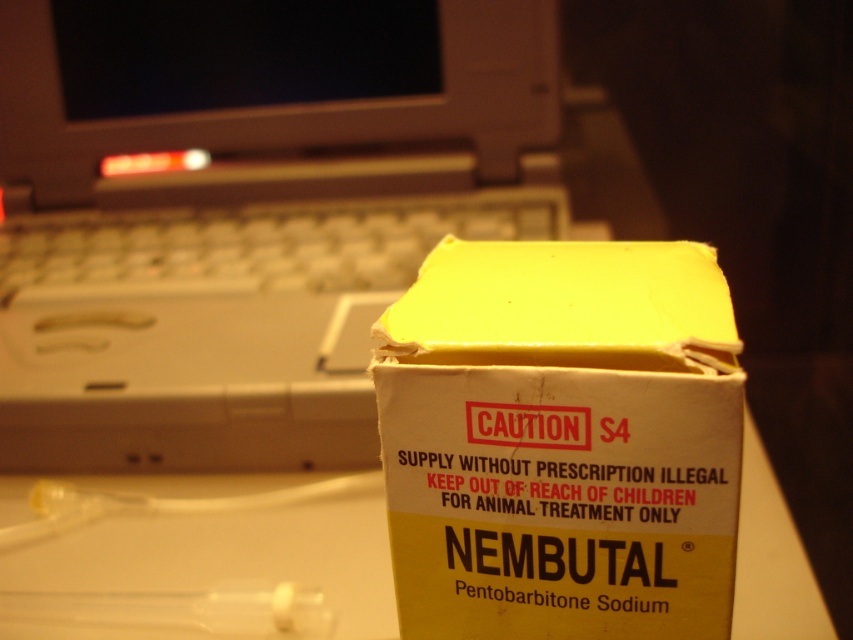
You need to place a 12 inch ruler between the yellow cardboard box at center and the white plastic keyboard at upper left. Is there enough space to fit it horizontally?

The distance between the yellow cardboard box at center and the white plastic keyboard at upper left is 24.52 inches. Since the ruler is 12 inches long, which is half of the distance, there is sufficient space to fit it horizontally between them.

What are the coordinates of the yellow cardboard box at center?

The yellow cardboard box at center is located at coordinates point (561, 440).